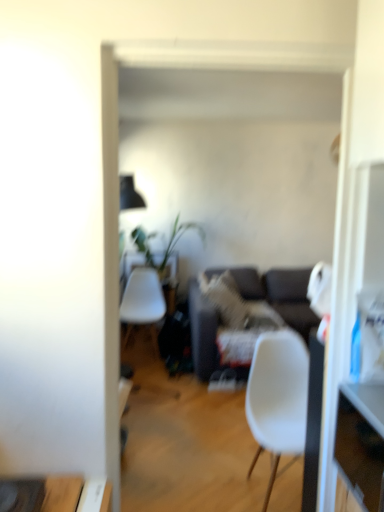
Question: From a real-world perspective, does wooden drawer at right sit lower than white matte chair at center?

Choices:
 (A) no
 (B) yes

Answer: (A)

Question: Would you say wooden drawer at right is a long distance from white matte chair at center?

Choices:
 (A) no
 (B) yes

Answer: (A)

Question: Does wooden drawer at right have a lesser height compared to white matte chair at center?

Choices:
 (A) no
 (B) yes

Answer: (B)

Question: Considering the relative sizes of wooden drawer at right and white matte chair at center in the image provided, is wooden drawer at right taller than white matte chair at center?

Choices:
 (A) yes
 (B) no

Answer: (B)

Question: Is wooden drawer at right oriented towards white matte chair at center?

Choices:
 (A) no
 (B) yes

Answer: (A)

Question: Considering their positions, is green leafy plant at center located in front of or behind wooden drawer at right?

Choices:
 (A) behind
 (B) front

Answer: (A)

Question: Considering the positions of point (160, 281) and point (337, 456), is point (160, 281) closer or farther from the camera than point (337, 456)?

Choices:
 (A) farther
 (B) closer

Answer: (A)

Question: Choose the correct answer: Is green leafy plant at center inside wooden drawer at right or outside it?

Choices:
 (A) outside
 (B) inside

Answer: (A)

Question: From the image's perspective, is green leafy plant at center located above or below wooden drawer at right?

Choices:
 (A) below
 (B) above

Answer: (B)

Question: Choose the correct answer: Is wooden drawer at right inside green leafy plant at center or outside it?

Choices:
 (A) outside
 (B) inside

Answer: (A)

Question: Based on their sizes in the image, would you say wooden drawer at right is bigger or smaller than green leafy plant at center?

Choices:
 (A) small
 (B) big

Answer: (A)

Question: Is point click(x=344, y=399) closer or farther from the camera than point click(x=167, y=259)?

Choices:
 (A) closer
 (B) farther

Answer: (A)

Question: Based on their positions, is wooden drawer at right located to the left or right of green leafy plant at center?

Choices:
 (A) right
 (B) left

Answer: (A)

Question: Considering the positions of dark gray fabric couch at center and white matte chair at center in the image, is dark gray fabric couch at center bigger or smaller than white matte chair at center?

Choices:
 (A) small
 (B) big

Answer: (B)

Question: Based on their positions, is dark gray fabric couch at center located to the left or right of white matte chair at center?

Choices:
 (A) right
 (B) left

Answer: (B)